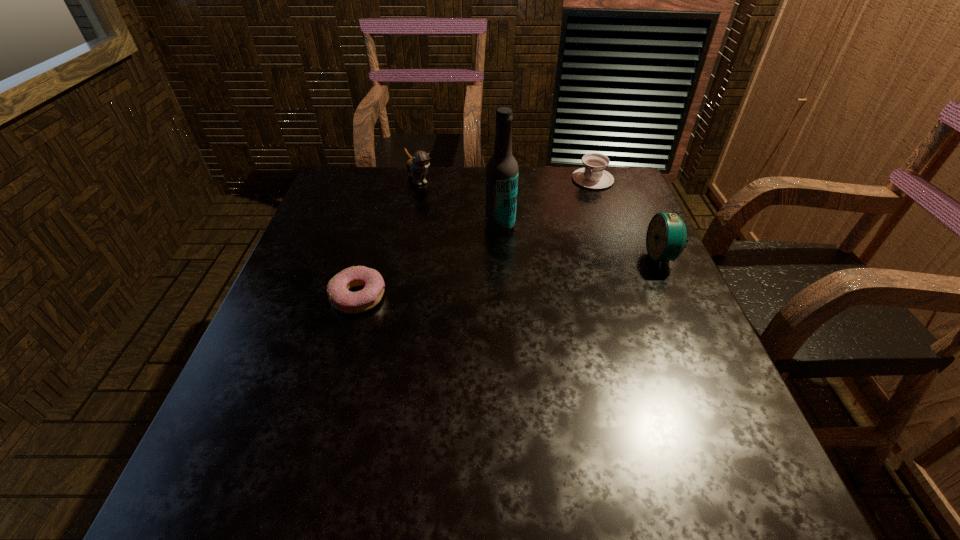
You are a GUI agent. You are given a task and a screenshot of the screen. Output one action in this format:
    pyautogui.click(x=<x>, y=<y>)
    Task: Click on the vacant area that lies between the third farthest object and the nearest object
    The image size is (960, 540).
    Given the screenshot: What is the action you would take?
    pyautogui.click(x=429, y=261)

This screenshot has width=960, height=540. What are the coordinates of `free spot between the fourth tallest object and the third object from left to right` in the screenshot? It's located at (546, 203).

Image resolution: width=960 pixels, height=540 pixels. I want to click on free space between the alarm clock and the third nearest object, so click(x=581, y=242).

Identify the location of vacant area that lies between the tallest object and the kitten. This screenshot has height=540, width=960. (460, 202).

Where is `object that is the third closest to the doughnut`? This screenshot has height=540, width=960. object that is the third closest to the doughnut is located at coordinates (593, 176).

Where is `object that is the fourth closest one to the fourth tallest object`? object that is the fourth closest one to the fourth tallest object is located at coordinates point(343,300).

This screenshot has height=540, width=960. What are the coordinates of `vacant space that satisfies the following two spatial constraints: 1. on the back side of the nearest object; 2. on the front-facing side of the rightmost object` in the screenshot? It's located at (370, 257).

The image size is (960, 540). I want to click on blank space that satisfies the following two spatial constraints: 1. on the front side of the beer bottle; 2. on the front-facing side of the alarm clock, so click(x=502, y=257).